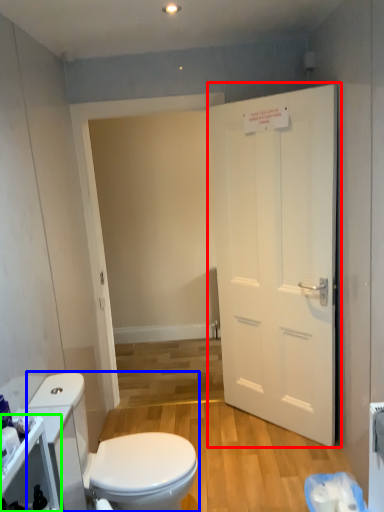
Question: Which object is positioned farthest from door (highlighted by a red box)? Select from toilet (highlighted by a blue box) and cabinetry (highlighted by a green box).

Choices:
 (A) toilet
 (B) cabinetry

Answer: (B)